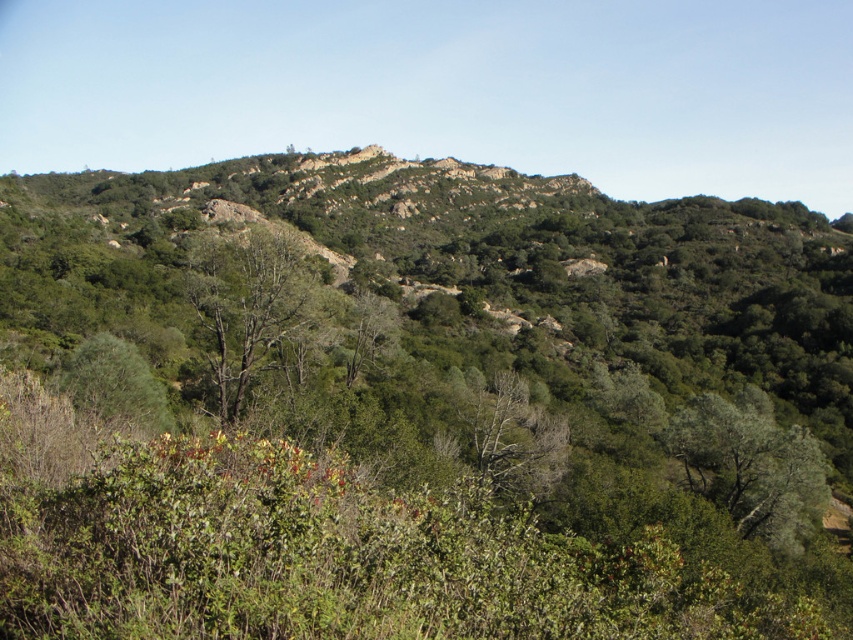
Consider the image. Is green matte tree at center smaller than green leafy tree at center?

Actually, green matte tree at center might be larger than green leafy tree at center.

Is point (263, 316) farther from camera compared to point (544, 420)?

That is False.

The height and width of the screenshot is (640, 853). Identify the location of green matte tree at center. (248, 304).

I want to click on green matte tree at center, so click(248, 304).

Between green leafy tree at center and green leafy tree at lower left, which one is positioned higher?

green leafy tree at lower left is above.

Locate an element on the screen. The image size is (853, 640). green leafy tree at center is located at coordinates (509, 433).

This screenshot has height=640, width=853. What are the coordinates of `green leafy tree at center` in the screenshot? It's located at click(509, 433).

Between point (683, 412) and point (473, 410), which one is positioned behind?

The point (473, 410) is behind.

Who is more distant from viewer, (775, 474) or (488, 417)?

Point (488, 417)

You are a GUI agent. You are given a task and a screenshot of the screen. Output one action in this format:
    pyautogui.click(x=<x>, y=<y>)
    Task: Click on the green leafy tree at lower right
    Image resolution: width=853 pixels, height=640 pixels.
    Given the screenshot: What is the action you would take?
    pyautogui.click(x=751, y=465)